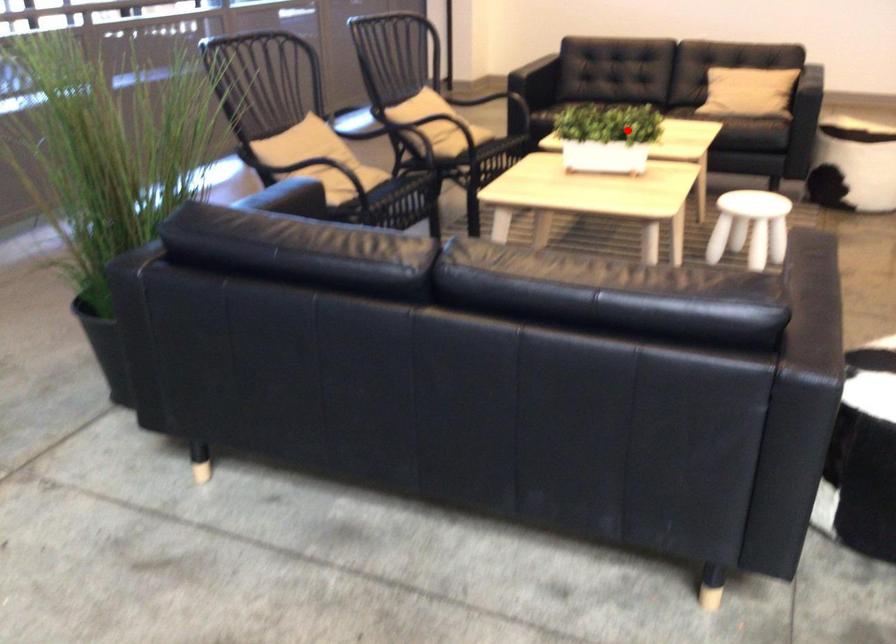
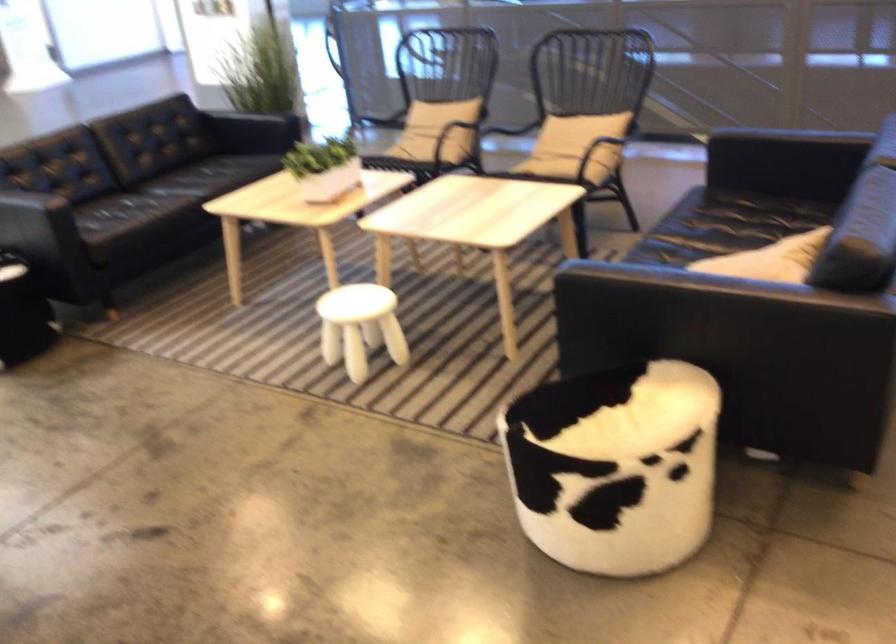
Question: I am providing you with two images of the same scene from different viewpoints. A red point is shown in image1. For the corresponding object point in image2, is it positioned nearer or farther from the camera?

Choices:
 (A) Nearer
 (B) Farther

Answer: (B)